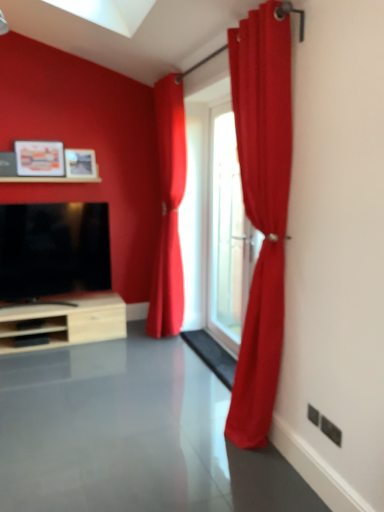
Question: Is matte wooden picture frame at upper left, which is counted as the first picture frame, starting from the left, positioned before matte wooden picture frame at upper left, the second picture frame positioned from the left?

Choices:
 (A) yes
 (B) no

Answer: (A)

Question: Can you confirm if matte wooden picture frame at upper left, the second picture frame when ordered from right to left, is taller than matte wooden picture frame at upper left, placed as the first picture frame when sorted from right to left?

Choices:
 (A) no
 (B) yes

Answer: (B)

Question: From a real-world perspective, does matte wooden picture frame at upper left, which is counted as the first picture frame, starting from the left, stand above matte wooden picture frame at upper left, placed as the first picture frame when sorted from right to left?

Choices:
 (A) no
 (B) yes

Answer: (B)

Question: Is matte wooden picture frame at upper left, which is counted as the first picture frame, starting from the left, directly adjacent to matte wooden picture frame at upper left, placed as the first picture frame when sorted from right to left?

Choices:
 (A) no
 (B) yes

Answer: (A)

Question: Does matte wooden picture frame at upper left, the second picture frame when ordered from right to left, have a greater width compared to matte wooden picture frame at upper left, the second picture frame positioned from the left?

Choices:
 (A) yes
 (B) no

Answer: (B)

Question: In terms of size, does matte wooden picture frame at upper left, the second picture frame positioned from the left, appear bigger or smaller than satin red curtain at center, placed as the first curtain when sorted from back to front?

Choices:
 (A) big
 (B) small

Answer: (B)

Question: Is matte wooden picture frame at upper left, placed as the first picture frame when sorted from right to left, wider or thinner than satin red curtain at center, which ranks as the second curtain in front-to-back order?

Choices:
 (A) thin
 (B) wide

Answer: (A)

Question: In terms of height, does matte wooden picture frame at upper left, the second picture frame positioned from the left, look taller or shorter compared to satin red curtain at center, placed as the first curtain when sorted from back to front?

Choices:
 (A) tall
 (B) short

Answer: (B)

Question: Considering the relative positions of matte wooden picture frame at upper left, placed as the first picture frame when sorted from right to left, and satin red curtain at center, placed as the first curtain when sorted from back to front, in the image provided, is matte wooden picture frame at upper left, placed as the first picture frame when sorted from right to left, to the left or to the right of satin red curtain at center, placed as the first curtain when sorted from back to front,?

Choices:
 (A) left
 (B) right

Answer: (A)

Question: Does point (175, 87) appear closer or farther from the camera than point (220, 135)?

Choices:
 (A) closer
 (B) farther

Answer: (A)

Question: Relative to transparent glass door at center, is satin red curtain at center, the second curtain positioned from the right, in front or behind?

Choices:
 (A) behind
 (B) front

Answer: (A)

Question: From a real-world perspective, is satin red curtain at center, which appears as the 1th curtain when viewed from the left, physically located above or below transparent glass door at center?

Choices:
 (A) below
 (B) above

Answer: (B)

Question: From their relative heights in the image, would you say satin red curtain at center, the second curtain positioned from the right, is taller or shorter than transparent glass door at center?

Choices:
 (A) short
 (B) tall

Answer: (B)

Question: Considering the relative positions of black glossy tv at left and transparent glass door at center in the image provided, is black glossy tv at left to the left or to the right of transparent glass door at center?

Choices:
 (A) left
 (B) right

Answer: (A)

Question: From a real-world perspective, is black glossy tv at left above or below transparent glass door at center?

Choices:
 (A) below
 (B) above

Answer: (A)